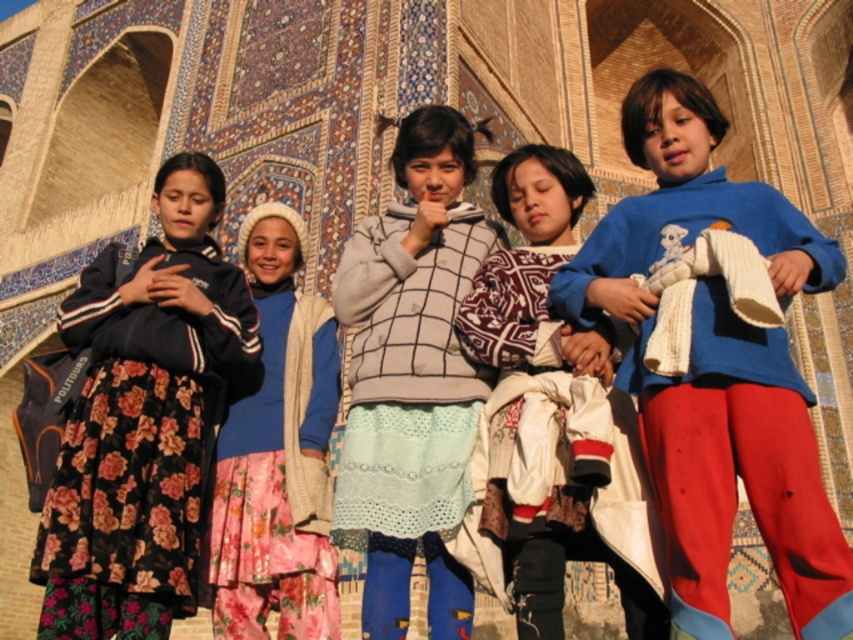
Is blue cotton sweater at center to the right of knitted sweater at center from the viewer's perspective?

Indeed, blue cotton sweater at center is positioned on the right side of knitted sweater at center.

Between blue cotton sweater at center and knitted sweater at center, which one is positioned lower?

knitted sweater at center

Identify the location of blue cotton sweater at center. (717, 369).

At what (x,y) coordinates should I click in order to perform the action: click on blue cotton sweater at center. Please return your answer as a coordinate pair (x, y). This screenshot has width=853, height=640. Looking at the image, I should click on (717, 369).

Does knitted sweater at center have a greater height compared to blue soft sweater at center?

Yes, knitted sweater at center is taller than blue soft sweater at center.

Does point (566, 403) lie behind point (223, 445)?

That is False.

Who is more distant from viewer, (601, 484) or (265, 230)?

The point (265, 230) is behind.

The height and width of the screenshot is (640, 853). I want to click on knitted sweater at center, so click(x=550, y=422).

Does blue cotton sweater at center have a smaller size compared to blue soft sweater at center?

Incorrect, blue cotton sweater at center is not smaller in size than blue soft sweater at center.

Between blue cotton sweater at center and blue soft sweater at center, which one is positioned higher?

blue cotton sweater at center

Between point (706, 284) and point (326, 342), which one is positioned in front?

Positioned in front is point (706, 284).

This screenshot has width=853, height=640. Find the location of `blue cotton sweater at center`. blue cotton sweater at center is located at coordinates (717, 369).